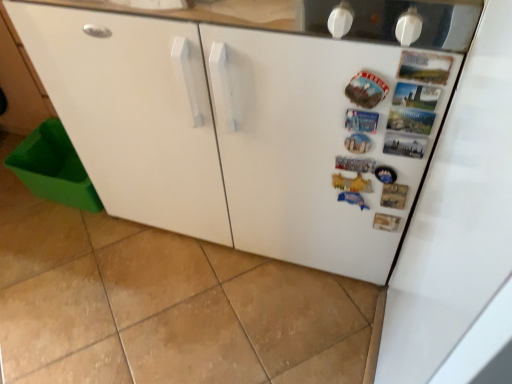
Question: From the image's perspective, is green plastic bin at lower left above white matte refrigerator at center-right?

Choices:
 (A) no
 (B) yes

Answer: (A)

Question: Considering the relative positions of green plastic bin at lower left and white matte refrigerator at center-right in the image provided, is green plastic bin at lower left in front of white matte refrigerator at center-right?

Choices:
 (A) no
 (B) yes

Answer: (B)

Question: Is green plastic bin at lower left located outside white matte refrigerator at center-right?

Choices:
 (A) no
 (B) yes

Answer: (B)

Question: Considering the relative sizes of green plastic bin at lower left and white matte refrigerator at center-right in the image provided, is green plastic bin at lower left taller than white matte refrigerator at center-right?

Choices:
 (A) yes
 (B) no

Answer: (B)

Question: Is green plastic bin at lower left at the left side of white matte refrigerator at center-right?

Choices:
 (A) no
 (B) yes

Answer: (B)

Question: Can you see green plastic bin at lower left touching white matte refrigerator at center-right?

Choices:
 (A) no
 (B) yes

Answer: (B)

Question: Can you confirm if white matte refrigerator at center-right is positioned to the left of green plastic bin at lower left?

Choices:
 (A) no
 (B) yes

Answer: (A)

Question: From a real-world perspective, is white matte refrigerator at center-right located beneath green plastic bin at lower left?

Choices:
 (A) yes
 (B) no

Answer: (B)

Question: Is white matte refrigerator at center-right next to green plastic bin at lower left?

Choices:
 (A) yes
 (B) no

Answer: (A)

Question: From the image's perspective, is white matte refrigerator at center-right on green plastic bin at lower left?

Choices:
 (A) yes
 (B) no

Answer: (A)

Question: Is the position of white matte refrigerator at center-right more distant than that of green plastic bin at lower left?

Choices:
 (A) yes
 (B) no

Answer: (A)

Question: From the image's perspective, would you say white matte refrigerator at center-right is shown under green plastic bin at lower left?

Choices:
 (A) no
 (B) yes

Answer: (A)

Question: Based on their positions, is white matte refrigerator at center-right located to the left or right of green plastic bin at lower left?

Choices:
 (A) right
 (B) left

Answer: (A)